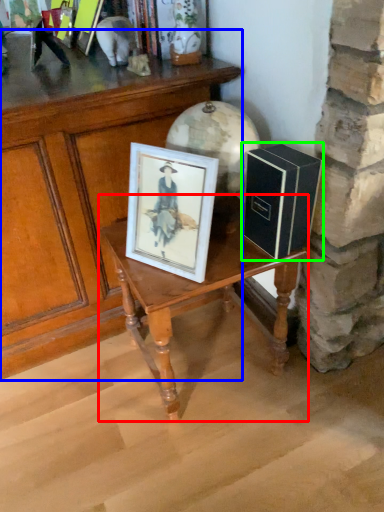
Question: Based on their relative distances, which object is farther from table (highlighted by a red box)? Choose from table (highlighted by a blue box) and book (highlighted by a green box).

Choices:
 (A) table
 (B) book

Answer: (A)